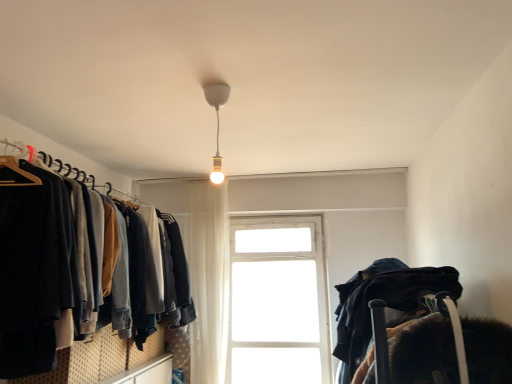
The height and width of the screenshot is (384, 512). What do you see at coordinates (208, 279) in the screenshot?
I see `white sheer curtain at center` at bounding box center [208, 279].

Identify the location of white matte bulb at center. (217, 123).

You are a GUI agent. You are given a task and a screenshot of the screen. Output one action in this format:
    pyautogui.click(x=<x>, y=<y>)
    Task: Click on the white sheer curtain at center
    This screenshot has height=384, width=512.
    Given the screenshot: What is the action you would take?
    pyautogui.click(x=208, y=279)

Is white matte bulb at center smaller than velvet dark blue blanket at right?

Yes, white matte bulb at center is smaller than velvet dark blue blanket at right.

From a real-world perspective, is white matte bulb at center positioned above or below velvet dark blue blanket at right?

Clearly, from a real-world perspective, white matte bulb at center is above velvet dark blue blanket at right.

Considering their positions, is white matte bulb at center located in front of or behind velvet dark blue blanket at right?

Visually, white matte bulb at center is located behind velvet dark blue blanket at right.

Considering the relative sizes of white matte bulb at center and velvet dark blue blanket at right in the image provided, is white matte bulb at center thinner than velvet dark blue blanket at right?

Indeed, white matte bulb at center has a lesser width compared to velvet dark blue blanket at right.

In terms of width, does velvet dark blue blanket at right look wider or thinner when compared to white glass window at center?

In the image, velvet dark blue blanket at right appears to be wider than white glass window at center.

Does velvet dark blue blanket at right turn towards white glass window at center?

No, velvet dark blue blanket at right is not turned towards white glass window at center.

Between velvet dark blue blanket at right and white glass window at center, which one appears on the left side from the viewer's perspective?

From the viewer's perspective, white glass window at center appears more on the left side.

Who is taller, velvet dark blue blanket at right or white glass window at center?

white glass window at center.

Which object is thinner, white sheer curtain at center or dark blue sweater at left?

white sheer curtain at center is thinner.

Do you think white sheer curtain at center is within dark blue sweater at left, or outside of it?

white sheer curtain at center exists outside the volume of dark blue sweater at left.

Does point (208, 275) come closer to viewer compared to point (75, 214)?

No.

Which of these two, white sheer curtain at center or dark blue sweater at left, is bigger?

dark blue sweater at left is bigger.

Between point (372, 291) and point (228, 223), which one is positioned behind?

Point (228, 223)

Is velvet dark blue blanket at right aimed at white sheer curtain at center?

No, velvet dark blue blanket at right is not turned towards white sheer curtain at center.

How different are the orientations of velvet dark blue blanket at right and white sheer curtain at center in degrees?

They differ by 90.6 degrees in their facing directions.

Is velvet dark blue blanket at right not near white sheer curtain at center?

velvet dark blue blanket at right is far away from white sheer curtain at center.

Is white glass window at center not near white matte bulb at center?

Yes.

In the image, there is a white glass window at center. In order to click on lamp above it (from the image's perspective) in this screenshot , I will do `click(217, 123)`.

Based on their sizes in the image, would you say white glass window at center is bigger or smaller than white matte bulb at center?

Clearly, white glass window at center is larger in size than white matte bulb at center.

Based on the photo, which is farther, (348,330) or (97,314)?

The point (97,314) is more distant.

Is velvet dark blue blanket at right oriented towards dark blue sweater at left?

Yes, velvet dark blue blanket at right is facing dark blue sweater at left.

Is the depth of velvet dark blue blanket at right less than that of dark blue sweater at left?

No, velvet dark blue blanket at right is behind dark blue sweater at left.

Is velvet dark blue blanket at right touching dark blue sweater at left?

velvet dark blue blanket at right and dark blue sweater at left are clearly separated.

Who is smaller, dark blue sweater at left or white matte bulb at center?

Smaller between the two is white matte bulb at center.

Is dark blue sweater at left far away from white matte bulb at center?

Yes.

Looking at this image, do you think dark blue sweater at left is within white matte bulb at center, or outside of it?

dark blue sweater at left cannot be found inside white matte bulb at center.

Looking at this image, can you confirm if dark blue sweater at left is shorter than white matte bulb at center?

Incorrect, the height of dark blue sweater at left does not fall short of that of white matte bulb at center.

The height and width of the screenshot is (384, 512). Find the location of `lamp above the velvet dark blue blanket at right (from the image's perspective)`. lamp above the velvet dark blue blanket at right (from the image's perspective) is located at coordinates click(x=217, y=123).

At what (x,y) coordinates should I click in order to perform the action: click on bunk bed on the right of white glass window at center. Please return your answer as a coordinate pair (x, y). Looking at the image, I should click on (402, 323).

Considering their positions, is dark blue sweater at left positioned closer to velvet dark blue blanket at right than white matte bulb at center?

white matte bulb at center is closer to velvet dark blue blanket at right.

From the image, which object appears to be farther from white matte bulb at center, dark blue sweater at left or white glass window at center?

Based on the image, white glass window at center appears to be further to white matte bulb at center.

Estimate the real-world distances between objects in this image. Which object is further from white matte bulb at center, white glass window at center or dark blue sweater at left?

Among the two, white glass window at center is located further to white matte bulb at center.

Considering their positions, is white glass window at center positioned closer to dark blue sweater at left than white matte bulb at center?

Among the two, white matte bulb at center is located nearer to dark blue sweater at left.

Looking at the image, which one is located closer to dark blue sweater at left, white glass window at center or velvet dark blue blanket at right?

velvet dark blue blanket at right is positioned closer to the anchor dark blue sweater at left.

Looking at the image, which one is located further to velvet dark blue blanket at right, white sheer curtain at center or white matte bulb at center?

Based on the image, white sheer curtain at center appears to be further to velvet dark blue blanket at right.

Which object lies further to the anchor point white glass window at center, white sheer curtain at center or dark blue sweater at left?

Based on the image, dark blue sweater at left appears to be further to white glass window at center.

When comparing their distances from velvet dark blue blanket at right, does white sheer curtain at center or dark blue sweater at left seem closer?

Among the two, dark blue sweater at left is located nearer to velvet dark blue blanket at right.

I want to click on lamp between velvet dark blue blanket at right and white sheer curtain at center along the z-axis, so click(x=217, y=123).

The width and height of the screenshot is (512, 384). Identify the location of bunk bed positioned between dark blue sweater at left and white glass window at center from near to far. (402, 323).

Locate an element on the screen. Image resolution: width=512 pixels, height=384 pixels. curtain between dark blue sweater at left and white glass window at center from front to back is located at coordinates (208, 279).

Identify the location of lamp between dark blue sweater at left and white sheer curtain at center from front to back. Image resolution: width=512 pixels, height=384 pixels. (217, 123).